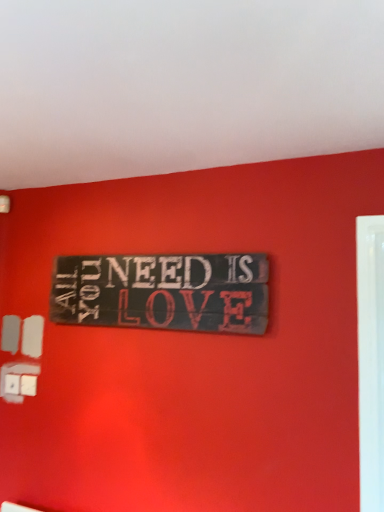
What do you see at coordinates (163, 292) in the screenshot? I see `distressed wood sign at center` at bounding box center [163, 292].

This screenshot has height=512, width=384. What are the coordinates of `distressed wood sign at center` in the screenshot? It's located at (163, 292).

Measure the distance between distressed wood sign at center and camera.

The depth of distressed wood sign at center is 5.19 feet.

Locate an element on the screen. This screenshot has width=384, height=512. distressed wood sign at center is located at coordinates (163, 292).